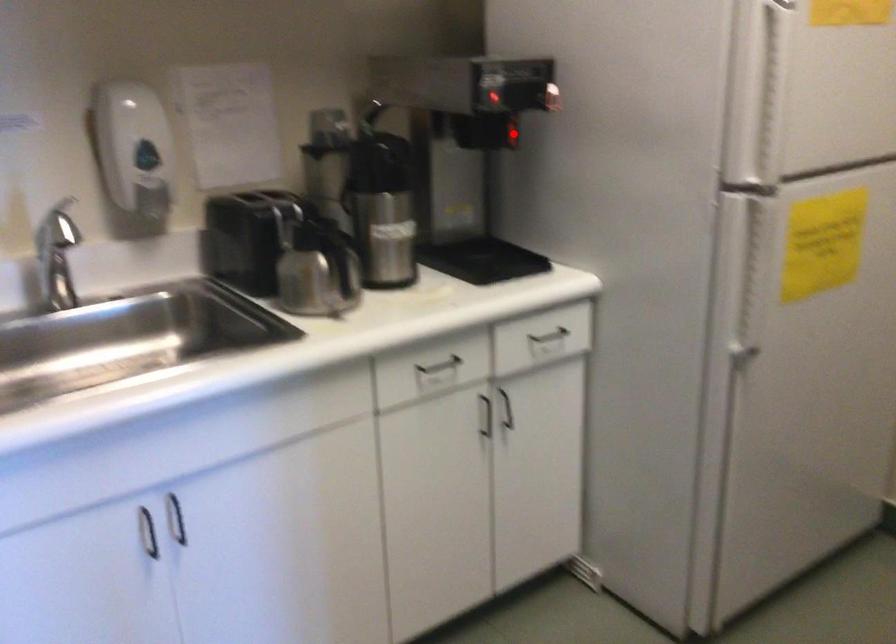
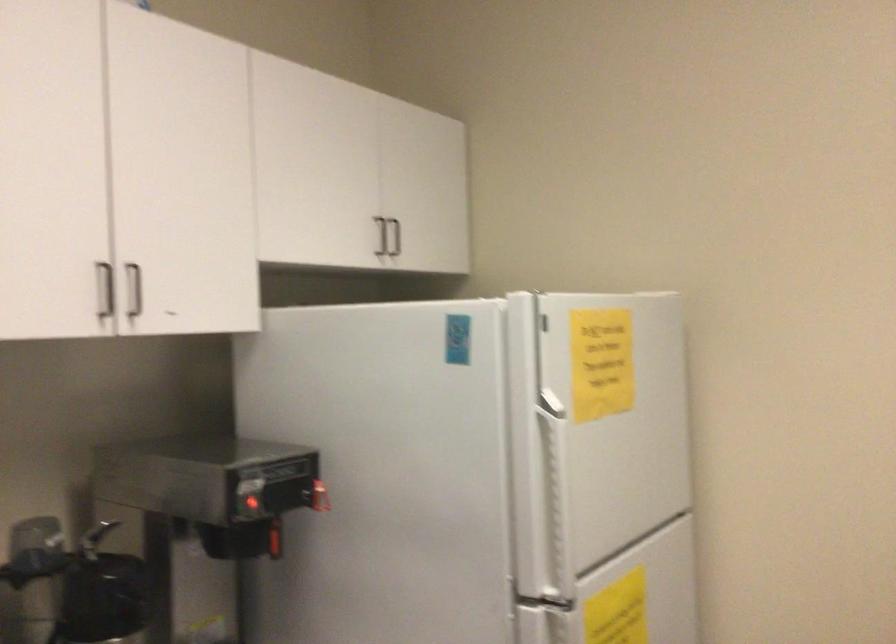
Question: I am providing you with two images of the same scene from different viewpoints. A red point is marked on the first image. Is the red point's position out of view in image 2?

Choices:
 (A) Yes
 (B) No

Answer: (B)